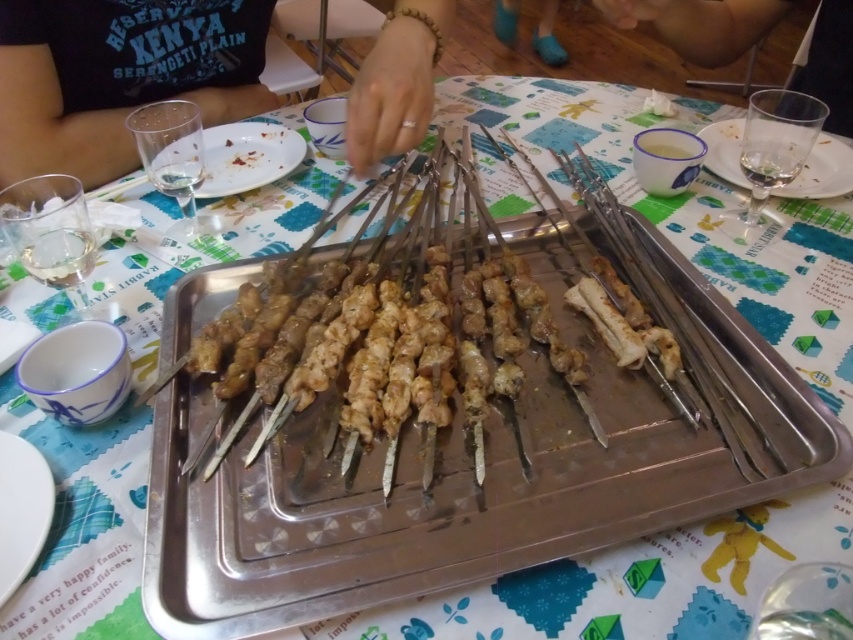
Consider the image. Does brown leather hand at upper right appear on the left side of clear plastic cup at upper left?

Incorrect, brown leather hand at upper right is not on the left side of clear plastic cup at upper left.

Who is positioned more to the left, brown leather hand at upper right or clear plastic cup at upper left?

From the viewer's perspective, clear plastic cup at upper left appears more on the left side.

Is point (635, 3) farther from camera compared to point (227, 184)?

No, it is not.

You are a GUI agent. You are given a task and a screenshot of the screen. Output one action in this format:
    pyautogui.click(x=<x>, y=<y>)
    Task: Click on the brown leather hand at upper right
    
    Given the screenshot: What is the action you would take?
    pyautogui.click(x=700, y=22)

Between point (349, 138) and point (837, 161), which one is positioned behind?

Point (837, 161)

Is matte black shirt at upper left thinner than clear glass at upper right?

Incorrect, matte black shirt at upper left's width is not less than clear glass at upper right's.

The width and height of the screenshot is (853, 640). What are the coordinates of `matte black shirt at upper left` in the screenshot? It's located at (50, 109).

Can you confirm if brown matte skewers at center is shorter than clear plastic cup at upper left?

In fact, brown matte skewers at center may be taller than clear plastic cup at upper left.

Does brown matte skewers at center have a greater height compared to clear plastic cup at upper left?

Yes, brown matte skewers at center is taller than clear plastic cup at upper left.

Who is more distant from viewer, (297, 401) or (228, 152)?

Point (228, 152)

Image resolution: width=853 pixels, height=640 pixels. I want to click on brown matte skewers at center, so click(405, 356).